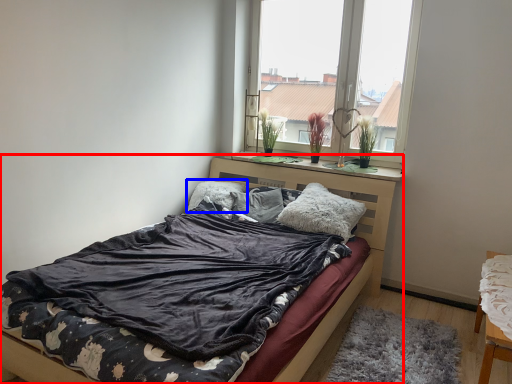
Question: Among these objects, which one is farthest to the camera, bed (highlighted by a red box) or pillow (highlighted by a blue box)?

Choices:
 (A) bed
 (B) pillow

Answer: (B)